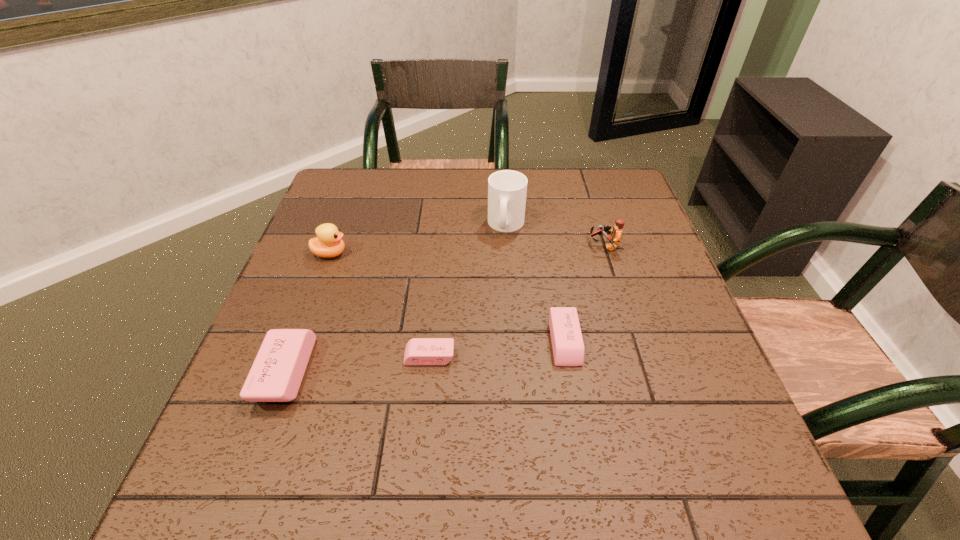
Find the location of a particular element. The height and width of the screenshot is (540, 960). vacant space at the near right corner is located at coordinates (705, 414).

Locate an element on the screen. free space between the tallest eraser and the shortest object is located at coordinates (357, 364).

Find the location of a particular element. The height and width of the screenshot is (540, 960). free area in between the shortest object and the mug is located at coordinates [x=468, y=291].

At what (x,y) coordinates should I click in order to perform the action: click on unoccupied position between the shortest eraser and the duckling. Please return your answer as a coordinate pair (x, y). Looking at the image, I should click on (380, 305).

Locate an element on the screen. The image size is (960, 540). free space between the fifth object from left to right and the tallest object is located at coordinates (536, 284).

The height and width of the screenshot is (540, 960). Find the location of `empty space that is in between the duckling and the Lego`. empty space that is in between the duckling and the Lego is located at coordinates (468, 250).

Locate an element on the screen. free space between the Lego and the leftmost eraser is located at coordinates (445, 309).

At what (x,y) coordinates should I click in order to perform the action: click on free space between the mug and the Lego. Please return your answer as a coordinate pair (x, y). Looking at the image, I should click on (555, 235).

At what (x,y) coordinates should I click in order to perform the action: click on free space between the fourth object from left to right and the leftmost eraser. Please return your answer as a coordinate pair (x, y). Looking at the image, I should click on (396, 298).

Locate an element on the screen. The height and width of the screenshot is (540, 960). vacant region between the third shortest object and the fourth object from right to left is located at coordinates (357, 364).